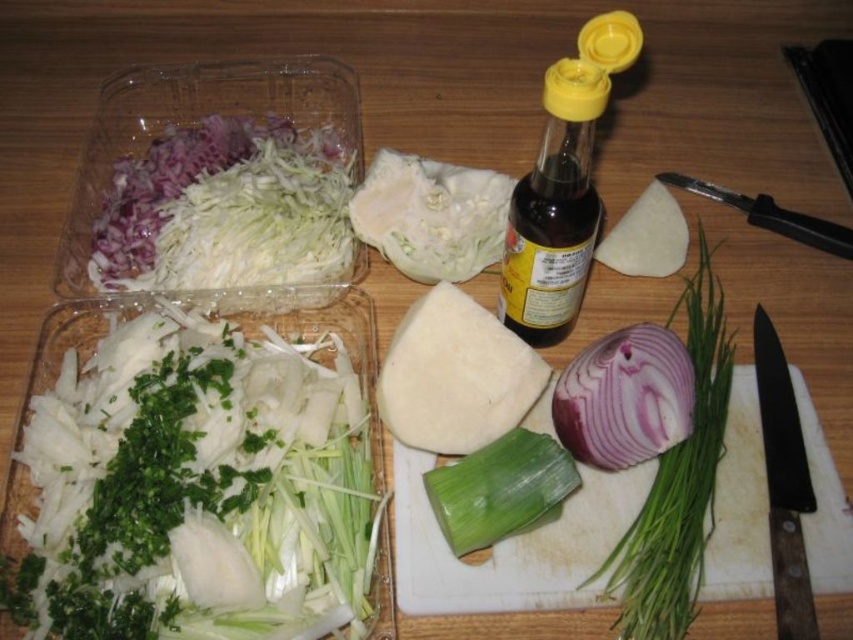
Question: Where is white leafy object at center located in relation to black wooden handle knife at right in the image?

Choices:
 (A) left
 (B) right

Answer: (A)

Question: Where is white leafy object at center located in relation to black wooden handle knife at right in the image?

Choices:
 (A) right
 (B) left

Answer: (B)

Question: Which of the following is the farthest from the observer?

Choices:
 (A) green leafy vegetable at center
 (B) white shredded cabbage at upper left
 (C) white leafy object at center

Answer: (C)

Question: Which object is positioned closest to the yellow plastic bottle at center-right?

Choices:
 (A) black plastic knife at upper right
 (B) white leafy object at center
 (C) green leafy vegetable at center
 (D) white plastic cutting board at center

Answer: (B)

Question: Can you confirm if purple translucent onion at center-right is positioned below white leafy object at center?

Choices:
 (A) yes
 (B) no

Answer: (A)

Question: Which point is farther to the camera?

Choices:
 (A) (553, 196)
 (B) (462, 292)
 (C) (33, 451)
 (D) (805, 218)

Answer: (D)